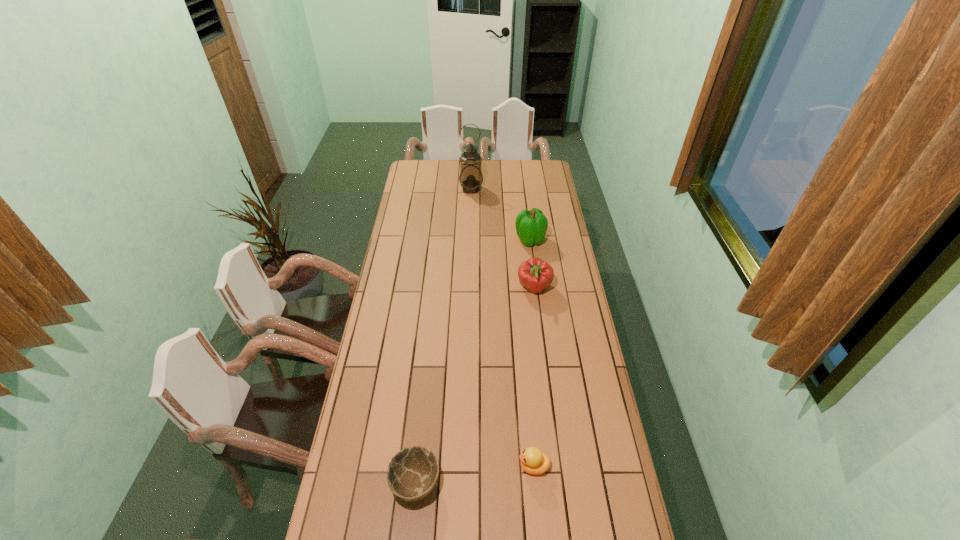
The image size is (960, 540). What are the coordinates of `free location located on the left of the nearer bell pepper` in the screenshot? It's located at (478, 288).

At what (x,y) coordinates should I click in order to perform the action: click on vacant space situated on the face of the duckling. Please return your answer as a coordinate pair (x, y). Looking at the image, I should click on (470, 466).

The image size is (960, 540). In order to click on vacant space located on the face of the duckling in this screenshot , I will do (409, 466).

Locate an element on the screen. The width and height of the screenshot is (960, 540). vacant space located 0.130m on the face of the duckling is located at coordinates (476, 466).

The width and height of the screenshot is (960, 540). In order to click on free spot located on the right of the leftmost object in this screenshot , I will do `click(500, 483)`.

Locate an element on the screen. The image size is (960, 540). object at the left edge is located at coordinates (412, 474).

The height and width of the screenshot is (540, 960). Identify the location of vacant space at the far edge of the desktop. (492, 159).

At what (x,y) coordinates should I click in order to perform the action: click on free spot at the left edge of the desktop. Please return your answer as a coordinate pair (x, y). Looking at the image, I should click on (414, 224).

Image resolution: width=960 pixels, height=540 pixels. In the image, there is a desktop. Find the location of `blank space at the right edge`. blank space at the right edge is located at coordinates (564, 358).

Image resolution: width=960 pixels, height=540 pixels. Identify the location of free spot at the far right corner of the desktop. coord(534,178).